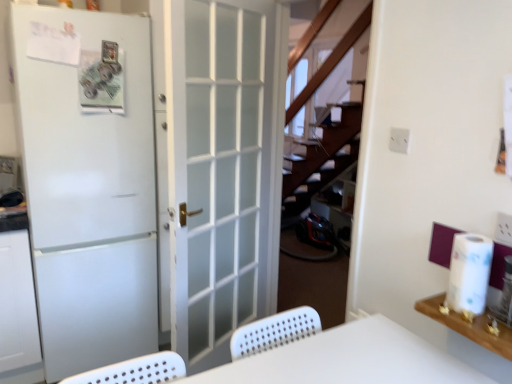
Question: Is white plastic table at center bigger or smaller than white paper at right?

Choices:
 (A) small
 (B) big

Answer: (B)

Question: In terms of width, does white plastic table at center look wider or thinner when compared to white paper at right?

Choices:
 (A) thin
 (B) wide

Answer: (B)

Question: Which is nearer to the white wood shelf at upper right?

Choices:
 (A) white plastic table at center
 (B) white matte door at left, which ranks as the first door in left-to-right order
 (C) white frosted glass door at center, the first door from the right
 (D) white paper at right

Answer: (D)

Question: Estimate the real-world distances between objects in this image. Which object is closer to the white wood shelf at upper right?

Choices:
 (A) white plastic table at center
 (B) white paper at right
 (C) white frosted glass door at center, arranged as the 2th door when viewed from the left
 (D) white matte door at left, which ranks as the first door in left-to-right order

Answer: (B)